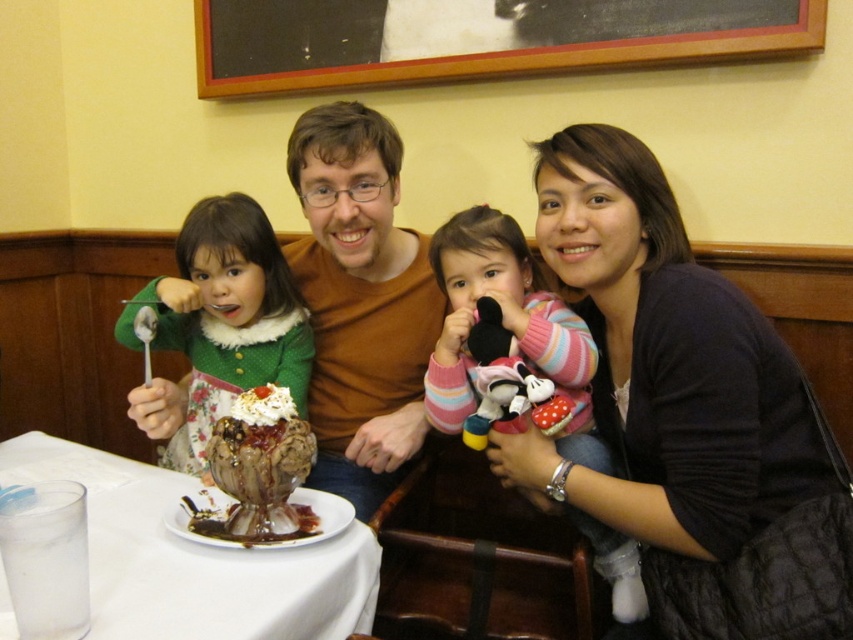
Between matte brown sweater at center and green fuzzy sweater at left, which one appears on the left side from the viewer's perspective?

Positioned to the left is green fuzzy sweater at left.

Which is behind, point (845, 497) or point (178, 246)?

The point (178, 246) is more distant.

Does point (778, 499) lie in front of point (270, 352)?

Yes, it is in front of point (270, 352).

Locate an element on the screen. Image resolution: width=853 pixels, height=640 pixels. matte brown sweater at center is located at coordinates (685, 413).

Is clear glass at lower left below green fuzzy sweater at left?

Indeed, clear glass at lower left is positioned under green fuzzy sweater at left.

Is point (96, 529) in front of point (277, 369)?

Yes, it is in front of point (277, 369).

Locate an element on the screen. clear glass at lower left is located at coordinates (194, 560).

Measure the distance from matte brown sweater at center to pink striped sweater at center.

matte brown sweater at center is 5.04 inches away from pink striped sweater at center.

I want to click on matte brown sweater at center, so click(685, 413).

Between point (775, 390) and point (560, 452), which one is positioned in front?

Point (775, 390)

At what (x,y) coordinates should I click in order to perform the action: click on matte brown sweater at center. Please return your answer as a coordinate pair (x, y). This screenshot has width=853, height=640. Looking at the image, I should click on (685, 413).